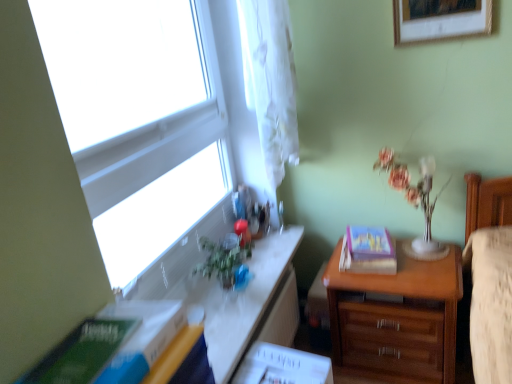
What do you see at coordinates (138, 118) in the screenshot? This screenshot has height=384, width=512. I see `transparent glass window at upper left` at bounding box center [138, 118].

The height and width of the screenshot is (384, 512). Describe the element at coordinates (397, 320) in the screenshot. I see `wooden chest of drawers at right` at that location.

Locate an element on the screen. The width and height of the screenshot is (512, 384). translucent glass vase at upper right is located at coordinates (415, 197).

Find the location of `hardcover book at right, placed as the 1th paperback book when sorted from back to front`. hardcover book at right, placed as the 1th paperback book when sorted from back to front is located at coordinates (368, 251).

Measure the distance between point (426, 31) and camera.

Point (426, 31) is 5.68 feet from camera.

What is the approximate width of wooden picture frame at upper right?

The width of wooden picture frame at upper right is 6.53 centimeters.

Where is `transparent glass window at upper left`? This screenshot has width=512, height=384. transparent glass window at upper left is located at coordinates (138, 118).

From the picture: Which is more to the right, wooden picture frame at upper right or hardcover book at right, which appears as the first paperback book when viewed from the right?

From the viewer's perspective, wooden picture frame at upper right appears more on the right side.

From the picture: Would you say wooden picture frame at upper right contains hardcover book at right, which appears as the first paperback book when viewed from the right?

No, wooden picture frame at upper right does not contain hardcover book at right, which appears as the first paperback book when viewed from the right.

Which of these two, wooden picture frame at upper right or hardcover book at right, placed as the 1th paperback book when sorted from back to front, is bigger?

Bigger between the two is wooden picture frame at upper right.

Would you say hardcover book at right, which is the second paperback book in front-to-back order, is inside or outside white glossy table at upper left?

hardcover book at right, which is the second paperback book in front-to-back order, is spatially situated outside white glossy table at upper left.

At what (x,y) coordinates should I click in order to perform the action: click on table above the hardcover book at right, placed as the 1th paperback book when sorted from back to front (from a real-world perspective). Please return your answer as a coordinate pair (x, y). This screenshot has width=512, height=384. Looking at the image, I should click on (239, 300).

Looking at this image, from the image's perspective, which one is positioned lower, hardcover book at right, which appears as the first paperback book when viewed from the right, or white glossy table at upper left?

From the image's view, white glossy table at upper left is below.

From their relative heights in the image, would you say hardcover book at right, which appears as the first paperback book when viewed from the right, is taller or shorter than white glossy table at upper left?

hardcover book at right, which appears as the first paperback book when viewed from the right, is shorter than white glossy table at upper left.

From the image's perspective, does hardcover book at right, which is the second paperback book in front-to-back order, appear lower than wooden chest of drawers at right?

No, from the image's perspective, hardcover book at right, which is the second paperback book in front-to-back order, is not beneath wooden chest of drawers at right.

Does hardcover book at right, which appears as the first paperback book when viewed from the right, come in front of wooden chest of drawers at right?

That is False.

Looking at this image, between hardcover book at right, placed as the 1th paperback book when sorted from back to front, and wooden chest of drawers at right, which one has larger width?

wooden chest of drawers at right.

Who is bigger, hardcover book at right, which is the second paperback book in front-to-back order, or wooden chest of drawers at right?

wooden chest of drawers at right is bigger.

Between green matte paperback book at lower left, the first paperback book when ordered from front to back, and white sheer curtain at upper left, which one has smaller size?

green matte paperback book at lower left, the first paperback book when ordered from front to back, is smaller.

From the image's perspective, is green matte paperback book at lower left, the first paperback book when ordered from front to back, under white sheer curtain at upper left?

Indeed, from the image's perspective, green matte paperback book at lower left, the first paperback book when ordered from front to back, is shown beneath white sheer curtain at upper left.

Locate an element on the screen. paperback book on the left side of white sheer curtain at upper left is located at coordinates (82, 352).

Would you say wooden chest of drawers at right is to the left or to the right of hardcover book at right, arranged as the 2th paperback book when viewed from the left, in the picture?

wooden chest of drawers at right is to the right of hardcover book at right, arranged as the 2th paperback book when viewed from the left.

From their relative heights in the image, would you say wooden chest of drawers at right is taller or shorter than hardcover book at right, arranged as the 2th paperback book when viewed from the left?

In the image, wooden chest of drawers at right appears to be taller than hardcover book at right, arranged as the 2th paperback book when viewed from the left.

Is wooden chest of drawers at right not inside hardcover book at right, which appears as the first paperback book when viewed from the right?

wooden chest of drawers at right lies outside hardcover book at right, which appears as the first paperback book when viewed from the right,'s area.

Is point (441, 383) in front of point (372, 240)?

Yes, it is.

Is white glossy table at upper left positioned with its back to transparent glass window at upper left?

No, white glossy table at upper left's orientation is not away from transparent glass window at upper left.

Between white glossy table at upper left and transparent glass window at upper left, which one has less height?

white glossy table at upper left is shorter.

How different are the orientations of white glossy table at upper left and transparent glass window at upper left in degrees?

There is a 0.132-degree angle between the facing directions of white glossy table at upper left and transparent glass window at upper left.

Can you tell me how much translucent glass vase at upper right and white sheer curtain at upper left differ in facing direction?

90.5 degrees.

Locate an element on the screen. This screenshot has height=384, width=512. floral arrangement below the white sheer curtain at upper left (from the image's perspective) is located at coordinates 415,197.

In the image, is translucent glass vase at upper right positioned in front of or behind white sheer curtain at upper left?

translucent glass vase at upper right is positioned farther from the viewer than white sheer curtain at upper left.

Is point (402, 176) in front of point (244, 10)?

No, it is behind (244, 10).

In order to click on picture frame on the right of hardcover book at right, arranged as the 2th paperback book when viewed from the left in this screenshot , I will do [439, 19].

I want to click on table above the hardcover book at right, placed as the 1th paperback book when sorted from back to front (from a real-world perspective), so tap(239, 300).

Looking at the image, which one is located closer to hardcover book at right, arranged as the 2th paperback book when viewed from the left, green matte paperback book at lower left, marked as the second paperback book in a right-to-left arrangement, or translucent glass vase at upper right?

translucent glass vase at upper right.

When comparing their distances from transparent glass window at upper left, does hardcover book at right, arranged as the 2th paperback book when viewed from the left, or wooden picture frame at upper right seem closer?

hardcover book at right, arranged as the 2th paperback book when viewed from the left, is closer to transparent glass window at upper left.

From the picture: Estimate the real-world distances between objects in this image. Which object is further from hardcover book at right, placed as the 1th paperback book when sorted from back to front, translucent glass vase at upper right or transparent glass window at upper left?

Based on the image, transparent glass window at upper left appears to be further to hardcover book at right, placed as the 1th paperback book when sorted from back to front.

Looking at this image, considering their positions, is wooden chest of drawers at right positioned closer to white sheer curtain at upper left than wooden picture frame at upper right?

wooden picture frame at upper right is closer to white sheer curtain at upper left.

Consider the image. When comparing their distances from green matte paperback book at lower left, the first paperback book positioned from the left, does translucent glass vase at upper right or hardcover book at right, which is the second paperback book in front-to-back order, seem further?

translucent glass vase at upper right.

From the picture: From the image, which object appears to be nearer to wooden picture frame at upper right, white glossy table at upper left or translucent glass vase at upper right?

translucent glass vase at upper right is positioned closer to the anchor wooden picture frame at upper right.

Based on their spatial positions, is wooden chest of drawers at right or hardcover book at right, which is the second paperback book in front-to-back order, closer to wooden picture frame at upper right?

hardcover book at right, which is the second paperback book in front-to-back order, lies closer to wooden picture frame at upper right than the other object.

Considering their positions, is white sheer curtain at upper left positioned further to wooden picture frame at upper right than translucent glass vase at upper right?

translucent glass vase at upper right is positioned further to the anchor wooden picture frame at upper right.

I want to click on the chest of drawers situated between transparent glass window at upper left and translucent glass vase at upper right from left to right, so click(397, 320).

Where is `paperback book between transparent glass window at upper left and translucent glass vase at upper right`? paperback book between transparent glass window at upper left and translucent glass vase at upper right is located at coordinates (368, 251).

The width and height of the screenshot is (512, 384). I want to click on paperback book located between white glossy table at upper left and translucent glass vase at upper right in the left-right direction, so click(x=368, y=251).

Locate an element on the screen. The width and height of the screenshot is (512, 384). table between green matte paperback book at lower left, the first paperback book when ordered from front to back, and hardcover book at right, arranged as the 2th paperback book when viewed from the left, in the front-back direction is located at coordinates (239, 300).